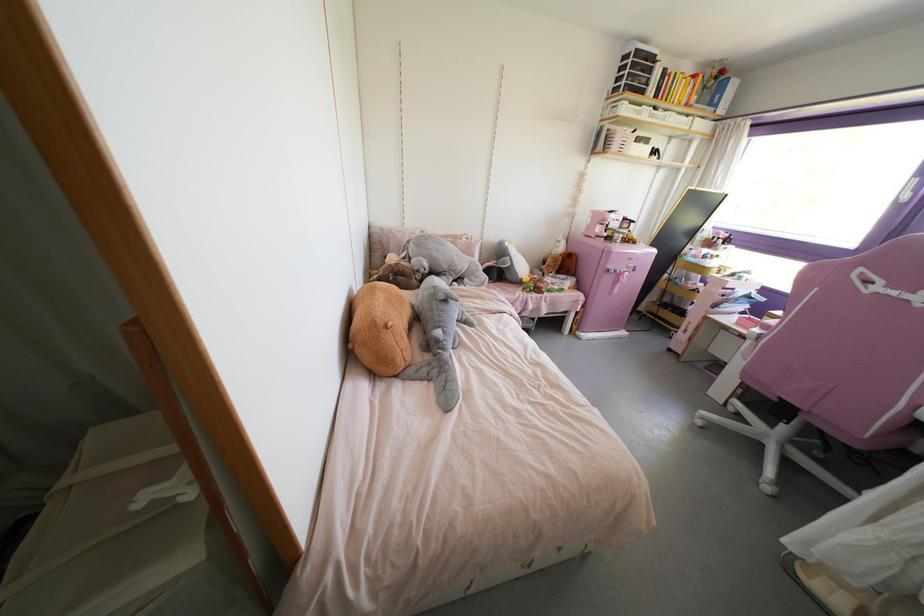
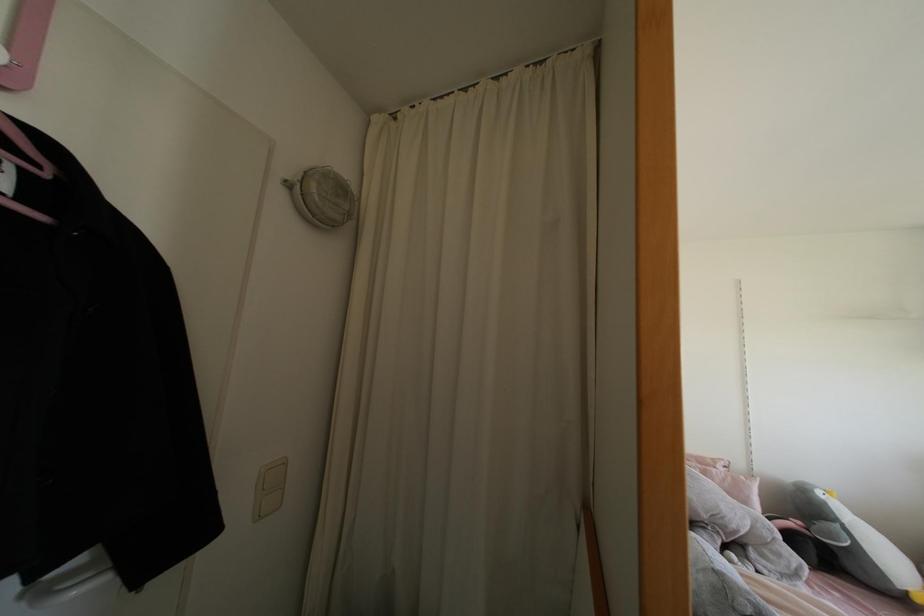
Find the pixel in the second image that matches the point at 460,235 in the first image.

(712, 460)